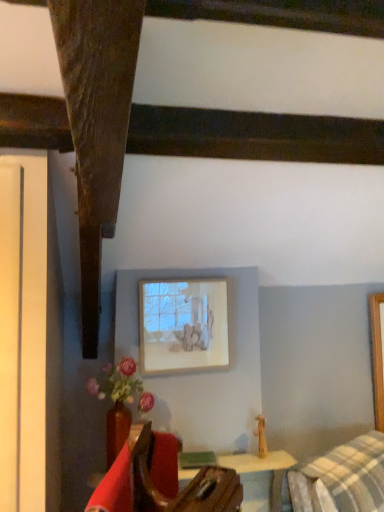
The height and width of the screenshot is (512, 384). Find the location of `matte ceramic vase at lower left`. matte ceramic vase at lower left is located at coordinates (121, 385).

The width and height of the screenshot is (384, 512). Describe the element at coordinates (121, 385) in the screenshot. I see `matte ceramic vase at lower left` at that location.

At what (x,y) coordinates should I click in order to perform the action: click on matte white picture frame at upper center. Please return your answer as a coordinate pair (x, y). This screenshot has width=384, height=512. Looking at the image, I should click on (183, 325).

In order to click on velvet red armchair at lower left in this screenshot , I will do `click(163, 480)`.

In order to face velvet red armchair at lower left, should I rotate leftwards or rightwards?

Turn left by 6.858 degrees to look at velvet red armchair at lower left.

Find the location of a particular element. The width and height of the screenshot is (384, 512). matte ceramic vase at lower left is located at coordinates (121, 385).

Does matte white picture frame at upper center touch matte ceramic vase at lower left?

No.

Where is `picture frame above the matte ceramic vase at lower left (from the image's perspective)`? Image resolution: width=384 pixels, height=512 pixels. picture frame above the matte ceramic vase at lower left (from the image's perspective) is located at coordinates (183, 325).

Is matte white picture frame at upper center closer to the viewer compared to matte ceramic vase at lower left?

No, the depth of matte white picture frame at upper center is greater than that of matte ceramic vase at lower left.

Based on the photo, from a real-world perspective, is matte white picture frame at upper center physically located above or below matte ceramic vase at lower left?

matte white picture frame at upper center is above matte ceramic vase at lower left.

From the image's perspective, is matte ceramic vase at lower left positioned above or below velvet red armchair at lower left?

Based on their image positions, matte ceramic vase at lower left is located above velvet red armchair at lower left.

Who is taller, matte ceramic vase at lower left or velvet red armchair at lower left?

Standing taller between the two is matte ceramic vase at lower left.

Looking at this image, can velvet red armchair at lower left be found inside matte ceramic vase at lower left?

That's incorrect, velvet red armchair at lower left is not inside matte ceramic vase at lower left.

From a real-world perspective, is velvet red armchair at lower left on matte ceramic vase at lower left?

Actually, velvet red armchair at lower left is physically below matte ceramic vase at lower left in the real world.

You are a GUI agent. You are given a task and a screenshot of the screen. Output one action in this format:
    pyautogui.click(x=<x>, y=<y>)
    Task: Click on the furniture located underneath the matte ceramic vase at lower left (from a real-world perspective)
    
    Given the screenshot: What is the action you would take?
    pyautogui.click(x=163, y=480)

Could you tell me if velvet red armchair at lower left is turned towards matte ceramic vase at lower left?

No, velvet red armchair at lower left is not aimed at matte ceramic vase at lower left.

From a real-world perspective, is matte white picture frame at upper center located higher than velvet red armchair at lower left?

Yes, from a real-world perspective, matte white picture frame at upper center is over velvet red armchair at lower left

Which is more to the right, matte white picture frame at upper center or velvet red armchair at lower left?

matte white picture frame at upper center is more to the right.

Is matte white picture frame at upper center not within velvet red armchair at lower left?

matte white picture frame at upper center is positioned outside velvet red armchair at lower left.

Considering the sizes of matte white picture frame at upper center and velvet red armchair at lower left in the image, is matte white picture frame at upper center bigger or smaller than velvet red armchair at lower left?

Considering their sizes, matte white picture frame at upper center takes up less space than velvet red armchair at lower left.

Which object is closer to the camera taking this photo, matte ceramic vase at lower left or matte white picture frame at upper center?

matte ceramic vase at lower left is more forward.

Considering the sizes of objects matte ceramic vase at lower left and matte white picture frame at upper center in the image provided, who is wider, matte ceramic vase at lower left or matte white picture frame at upper center?

matte ceramic vase at lower left.

Is matte ceramic vase at lower left facing away from matte white picture frame at upper center?

No, matte ceramic vase at lower left is not facing the opposite direction of matte white picture frame at upper center.

You are a GUI agent. You are given a task and a screenshot of the screen. Output one action in this format:
    pyautogui.click(x=<x>, y=<y>)
    Task: Click on the furniture directly beneath the matte white picture frame at upper center (from a real-world perspective)
    The width and height of the screenshot is (384, 512).
    Given the screenshot: What is the action you would take?
    pyautogui.click(x=163, y=480)

What's the angular difference between velvet red armchair at lower left and matte white picture frame at upper center's facing directions?

The angular difference between velvet red armchair at lower left and matte white picture frame at upper center is 57.2 degrees.

Between velvet red armchair at lower left and matte white picture frame at upper center, which one appears on the left side from the viewer's perspective?

Positioned to the left is velvet red armchair at lower left.

Based on the photo, could you tell me if velvet red armchair at lower left is facing matte white picture frame at upper center?

No, velvet red armchair at lower left is not turned towards matte white picture frame at upper center.

Where is `picture frame lying behind the matte ceramic vase at lower left`? The height and width of the screenshot is (512, 384). picture frame lying behind the matte ceramic vase at lower left is located at coordinates (183, 325).

Where is `furniture that appears below the matte ceramic vase at lower left (from a real-world perspective)`? furniture that appears below the matte ceramic vase at lower left (from a real-world perspective) is located at coordinates (163, 480).

When comparing their distances from matte white picture frame at upper center, does velvet red armchair at lower left or matte ceramic vase at lower left seem further?

Among the two, velvet red armchair at lower left is located further to matte white picture frame at upper center.

Looking at the image, which one is located closer to matte ceramic vase at lower left, velvet red armchair at lower left or matte white picture frame at upper center?

Based on the image, matte white picture frame at upper center appears to be nearer to matte ceramic vase at lower left.

Estimate the real-world distances between objects in this image. Which object is closer to velvet red armchair at lower left, matte white picture frame at upper center or matte ceramic vase at lower left?

The object closer to velvet red armchair at lower left is matte ceramic vase at lower left.

Considering their positions, is matte white picture frame at upper center positioned closer to matte ceramic vase at lower left than velvet red armchair at lower left?

matte white picture frame at upper center.

Looking at the image, which one is located further to matte white picture frame at upper center, matte ceramic vase at lower left or velvet red armchair at lower left?

Among the two, velvet red armchair at lower left is located further to matte white picture frame at upper center.

Considering their positions, is matte ceramic vase at lower left positioned further to velvet red armchair at lower left than matte white picture frame at upper center?

matte white picture frame at upper center.

Image resolution: width=384 pixels, height=512 pixels. Identify the location of flower located between velvet red armchair at lower left and matte white picture frame at upper center in the depth direction. (121, 385).